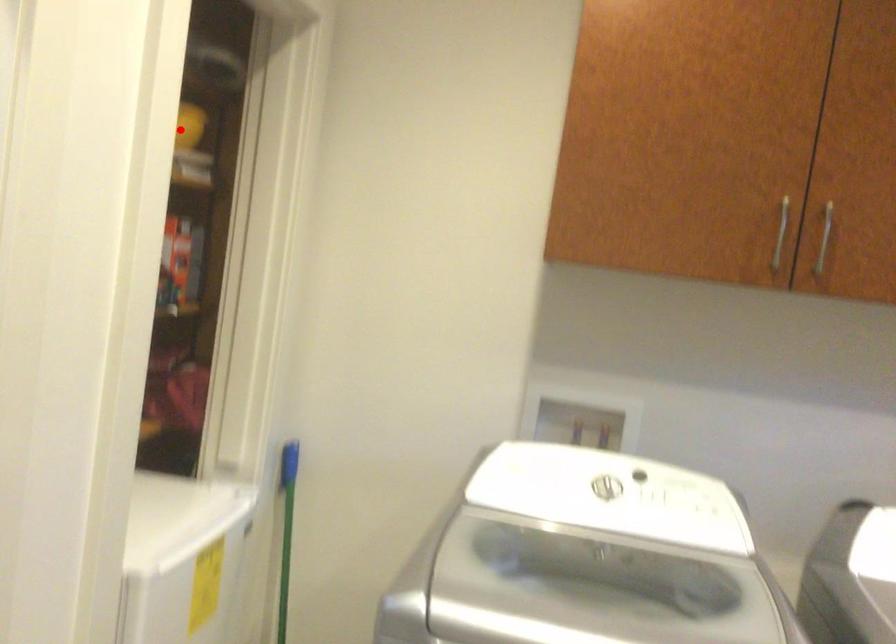
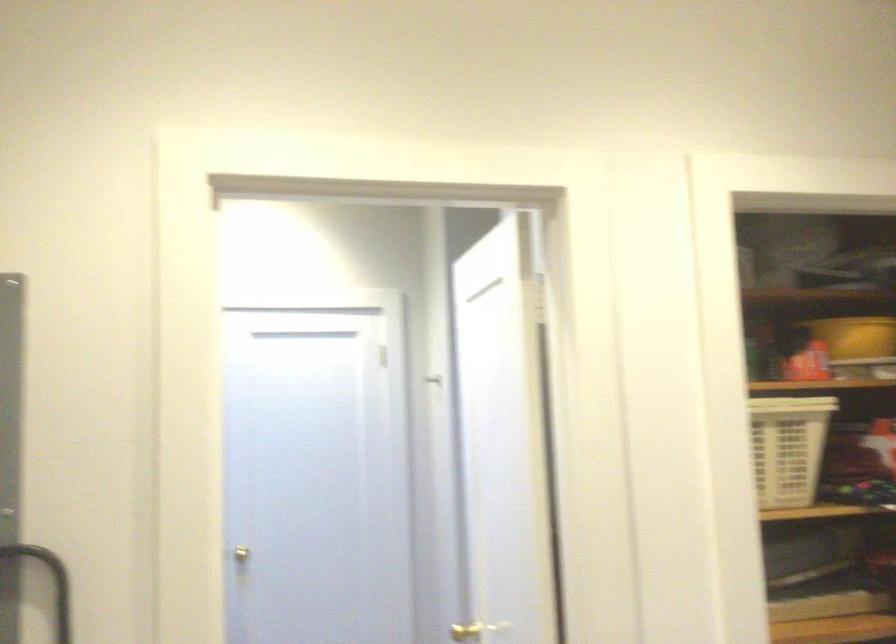
In the second image, find the point that corresponds to the highlighted location in the first image.

(855, 337)